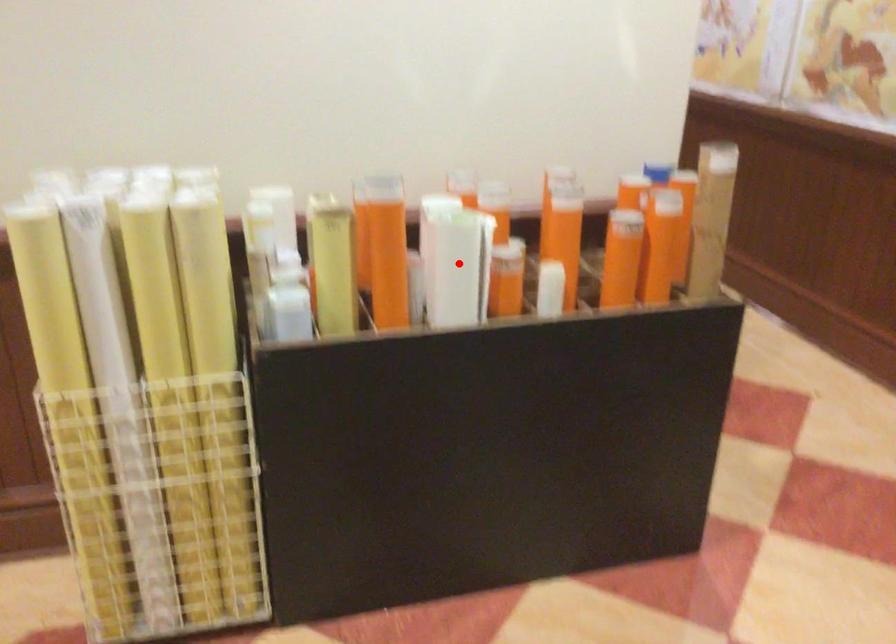
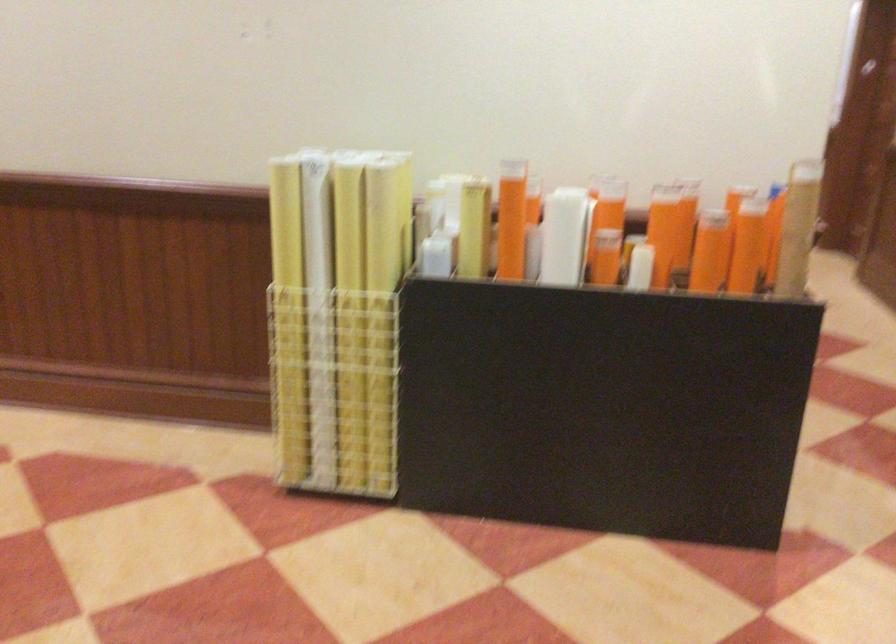
Where in the second image is the point corresponding to the highlighted location from the first image?

(564, 236)